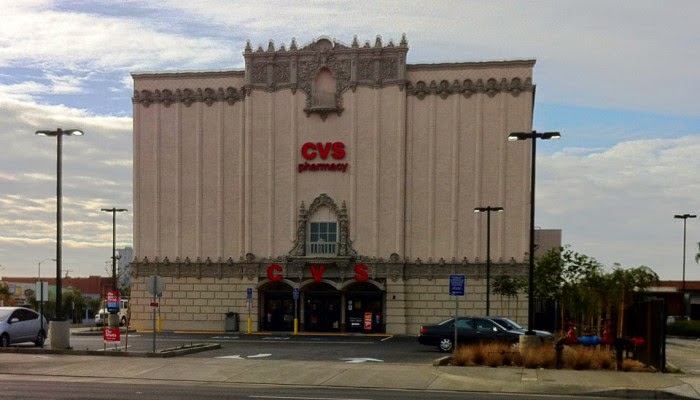
Find the location of `light pink protruding pillars`. light pink protruding pillars is located at coordinates (452, 167), (353, 157), (223, 170).